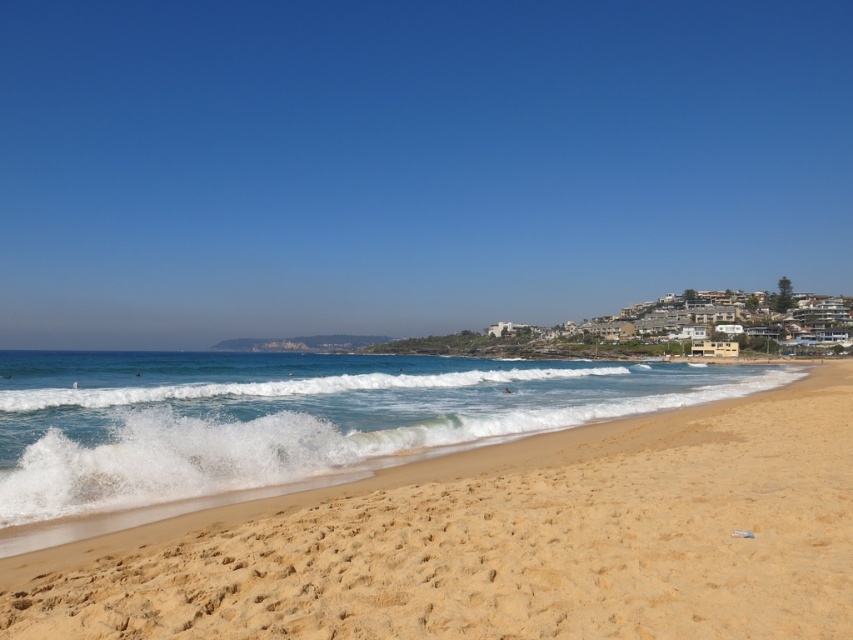
Which is below, sandy yellow at beach right or white foamy wave at center?

white foamy wave at center is lower down.

Between sandy yellow at beach right and white foamy wave at center, which one has more height?

white foamy wave at center is taller.

Locate an element on the screen. sandy yellow at beach right is located at coordinates (502, 541).